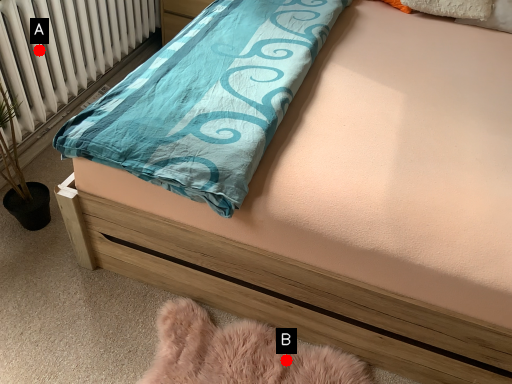
Question: Two points are circled on the image, labeled by A and B beside each circle. Which point is closer to the camera?

Choices:
 (A) A is closer
 (B) B is closer

Answer: (B)